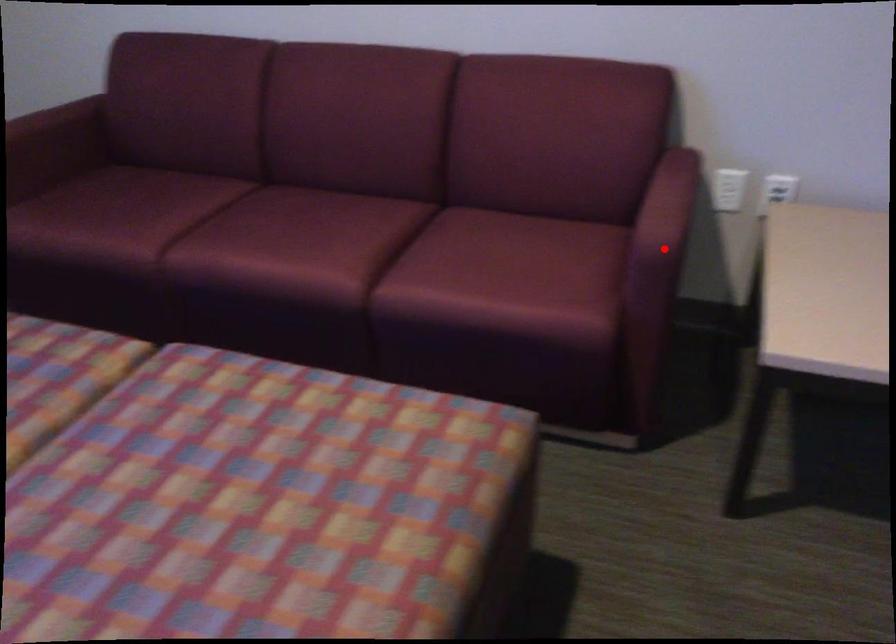
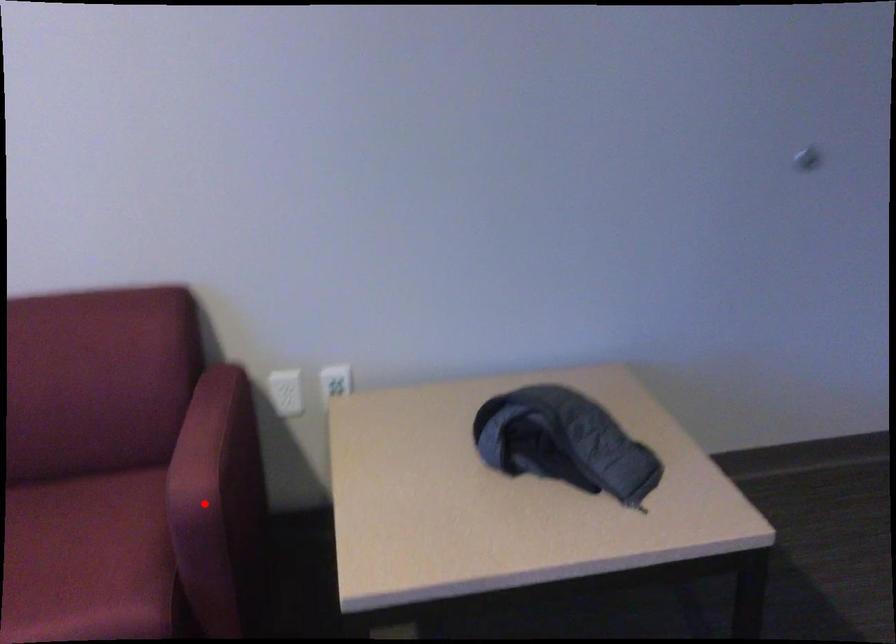
Based on the photo, I am providing you with two images of the same scene from different viewpoints. A red point is marked on the first image and another point is marked on the second image. Are the points marked in image1 and image2 representing the same 3D position?

Yes